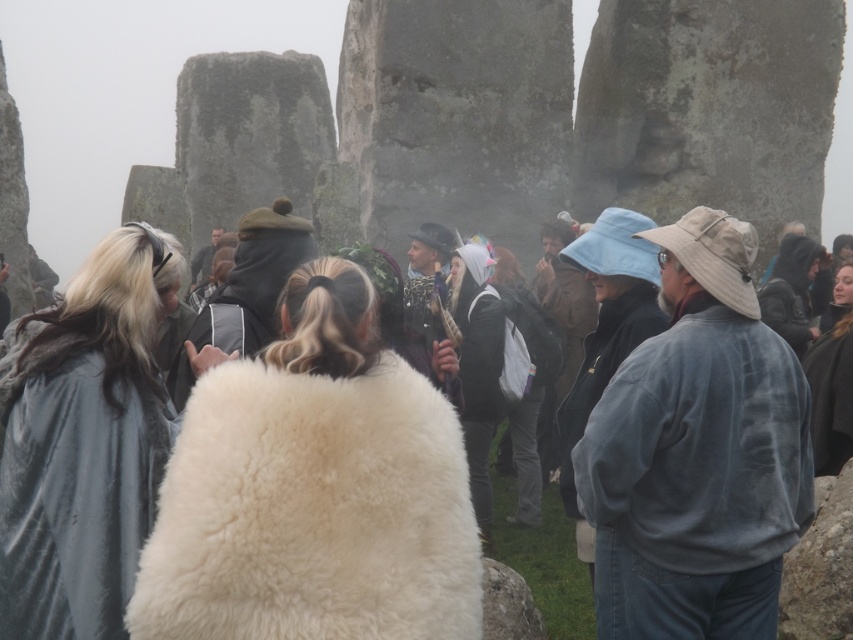
You are a photographer trying to capture both the white fluffy coat at center and the light blue fabric hat at center in a single frame. Based on their sizes, which object should you focus on first to ensure both fit in the photo?

The white fluffy coat at center occupies less space than the light blue fabric hat at center, so you should focus on the light blue fabric hat at center first to ensure both fit in the photo.

You are standing at the point with coordinates point (801, 262) and want to walk to the point with coordinates point (329, 483). Will you have to walk towards the front or the back of the scene?

You will have to walk towards the front of the scene because point (329, 483) is in front of point (801, 262).

You are standing at the Stonehenge site and want to reach the point marked at coordinates (459, 628). If your walking speed is 3 feet per second, how many seconds will it take you to reach that point?

The point at (459, 628) is 190.43 feet away from the viewer. At a walking speed of 3 feet per second, it would take approximately 63.48 seconds to reach the point.